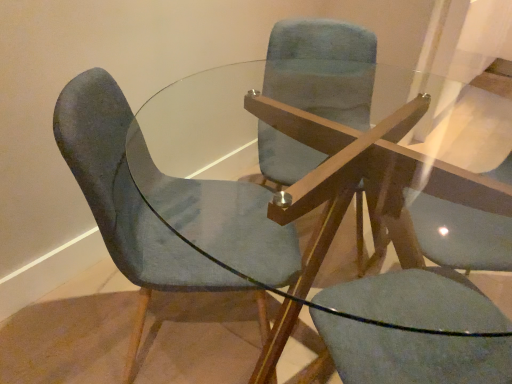
Question: Is velvet blue chair at center, arranged as the 1th chair when viewed from the left, to the right of velvet blue chair at left, arranged as the second chair when viewed from the left, from the viewer's perspective?

Choices:
 (A) yes
 (B) no

Answer: (B)

Question: Can you confirm if velvet blue chair at center, arranged as the 1th chair when viewed from the left, is wider than velvet blue chair at left, arranged as the second chair when viewed from the left?

Choices:
 (A) no
 (B) yes

Answer: (A)

Question: From the image's perspective, is velvet blue chair at center, acting as the 2th chair starting from the right, located beneath velvet blue chair at left, the first chair viewed from the right?

Choices:
 (A) yes
 (B) no

Answer: (B)

Question: Are velvet blue chair at center, acting as the 2th chair starting from the right, and velvet blue chair at left, arranged as the second chair when viewed from the left, making contact?

Choices:
 (A) yes
 (B) no

Answer: (B)

Question: Looking at the image, does velvet blue chair at center, arranged as the 1th chair when viewed from the left, seem bigger or smaller compared to matte blue swivel chair at center?

Choices:
 (A) big
 (B) small

Answer: (B)

Question: Looking at their shapes, would you say velvet blue chair at center, arranged as the 1th chair when viewed from the left, is wider or thinner than matte blue swivel chair at center?

Choices:
 (A) wide
 (B) thin

Answer: (A)

Question: Relative to matte blue swivel chair at center, is velvet blue chair at center, arranged as the 1th chair when viewed from the left, in front or behind?

Choices:
 (A) front
 (B) behind

Answer: (B)

Question: Is velvet blue chair at center, arranged as the 1th chair when viewed from the left, situated inside matte blue swivel chair at center or outside?

Choices:
 (A) inside
 (B) outside

Answer: (B)

Question: From the image's perspective, is matte blue swivel chair at center above or below velvet blue chair at center, arranged as the 1th chair when viewed from the left?

Choices:
 (A) below
 (B) above

Answer: (A)

Question: Considering their positions, is matte blue swivel chair at center located in front of or behind velvet blue chair at center, acting as the 2th chair starting from the right?

Choices:
 (A) behind
 (B) front

Answer: (B)

Question: In terms of width, does matte blue swivel chair at center look wider or thinner when compared to velvet blue chair at center, arranged as the 1th chair when viewed from the left?

Choices:
 (A) wide
 (B) thin

Answer: (B)

Question: Considering the relative positions of matte blue swivel chair at center and velvet blue chair at center, arranged as the 1th chair when viewed from the left, in the image provided, is matte blue swivel chair at center to the left or to the right of velvet blue chair at center, arranged as the 1th chair when viewed from the left,?

Choices:
 (A) right
 (B) left

Answer: (A)

Question: Considering their positions, is matte blue swivel chair at center located in front of or behind velvet blue chair at left, the first chair viewed from the right?

Choices:
 (A) behind
 (B) front

Answer: (B)

Question: Considering the positions of matte blue swivel chair at center and velvet blue chair at left, arranged as the second chair when viewed from the left, in the image, is matte blue swivel chair at center bigger or smaller than velvet blue chair at left, arranged as the second chair when viewed from the left,?

Choices:
 (A) small
 (B) big

Answer: (A)